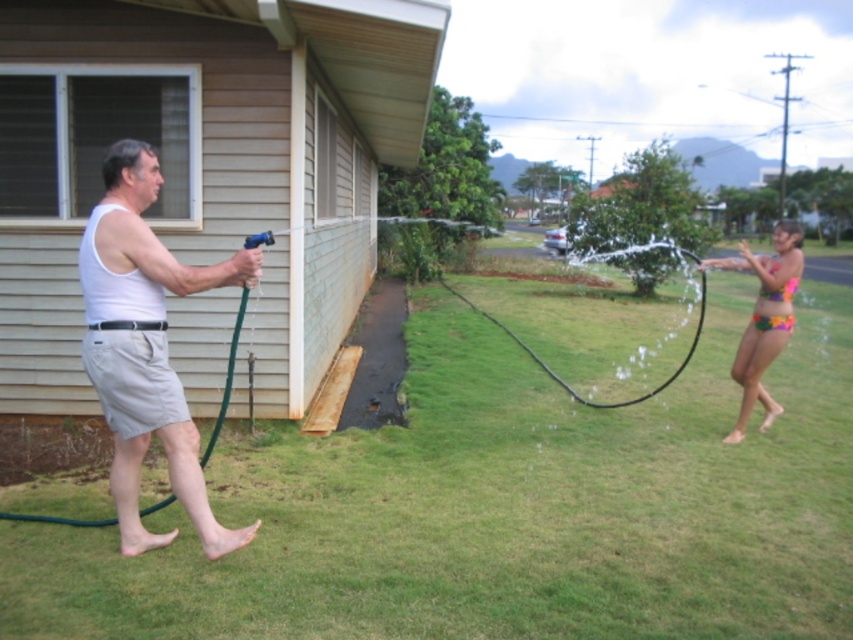
Which is in front, point (119, 253) or point (790, 285)?

Point (119, 253) is more forward.

Does white matte tank top at left have a lesser width compared to multicolored fabric bikini top at right?

Incorrect, white matte tank top at left's width is not less than multicolored fabric bikini top at right's.

I want to click on white matte tank top at left, so click(x=146, y=346).

Is green grass at center bigger than white matte tank top at left?

Yes, green grass at center is bigger than white matte tank top at left.

Does green grass at center have a smaller size compared to white matte tank top at left?

No, green grass at center is not smaller than white matte tank top at left.

What do you see at coordinates (502, 508) in the screenshot? The height and width of the screenshot is (640, 853). I see `green grass at center` at bounding box center [502, 508].

Identify the location of green grass at center. This screenshot has width=853, height=640. (502, 508).

Is green rubber hose at left to the left of multicolored fabric bikini top at right from the viewer's perspective?

Yes, green rubber hose at left is to the left of multicolored fabric bikini top at right.

Is point (224, 413) farther from viewer compared to point (769, 269)?

That is False.

At what (x,y) coordinates should I click in order to perform the action: click on green rubber hose at left. Please return your answer as a coordinate pair (x, y). The height and width of the screenshot is (640, 853). Looking at the image, I should click on (225, 378).

The height and width of the screenshot is (640, 853). Find the location of `green rubber hose at left`. green rubber hose at left is located at coordinates (225, 378).